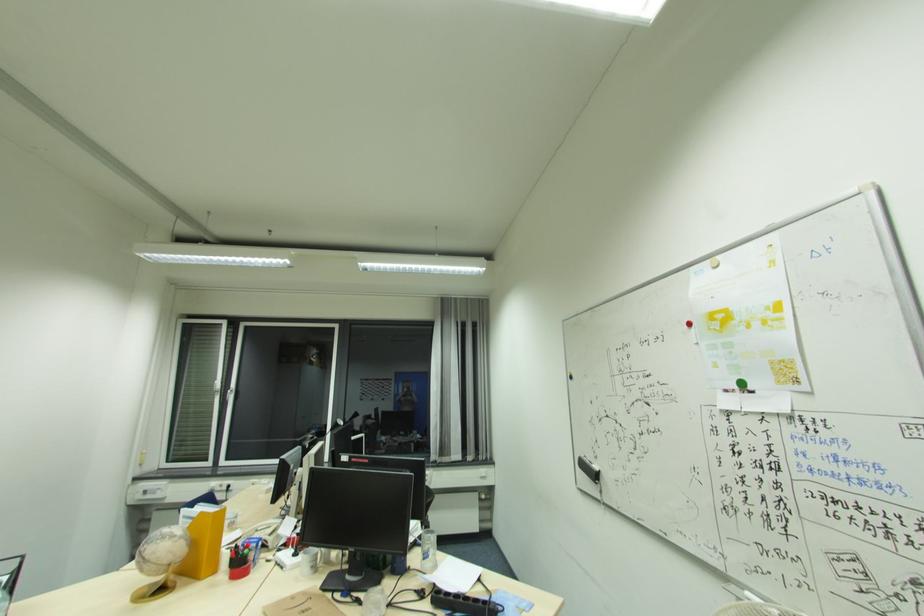
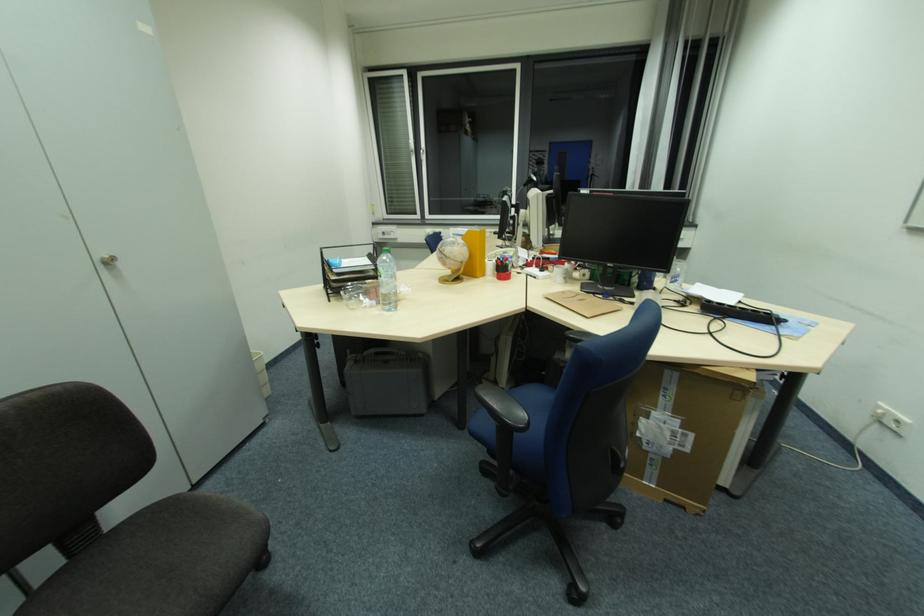
First-person continuous shooting, in which direction is the camera rotating?

The camera rotated toward left-down.